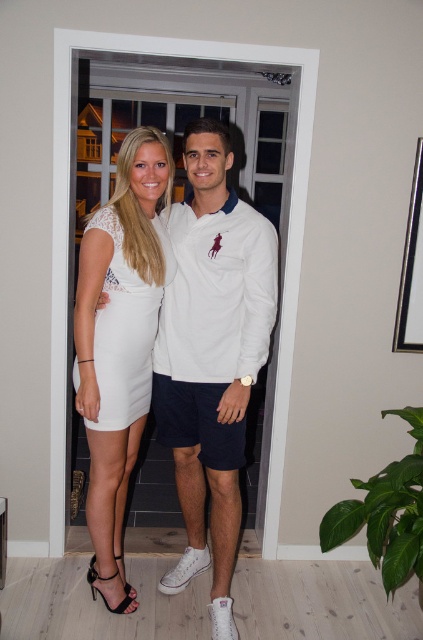
Is white matte dress at center further to camera compared to white lace dress at center?

No, it is not.

Which is above, white matte dress at center or white lace dress at center?

white lace dress at center is higher up.

Describe the element at coordinates (211, 356) in the screenshot. This screenshot has height=640, width=423. I see `white matte dress at center` at that location.

Where is `white matte dress at center`? This screenshot has width=423, height=640. white matte dress at center is located at coordinates (211, 356).

Who is more distant from viewer, (164, 394) or (142, 333)?

Positioned behind is point (164, 394).

Is point (213, 292) in front of point (156, 316)?

Yes, point (213, 292) is closer to viewer.

Locate an element on the screen. white matte dress at center is located at coordinates (211, 356).

Is white lace dress at center wider than white satin dress at center?

No.

Is white lace dress at center smaller than white satin dress at center?

Actually, white lace dress at center might be larger than white satin dress at center.

Image resolution: width=423 pixels, height=640 pixels. In order to click on white lace dress at center in this screenshot , I will do `click(118, 344)`.

At what (x,y) coordinates should I click in order to perform the action: click on white lace dress at center. Please return your answer as a coordinate pair (x, y). This screenshot has height=640, width=423. Looking at the image, I should click on (118, 344).